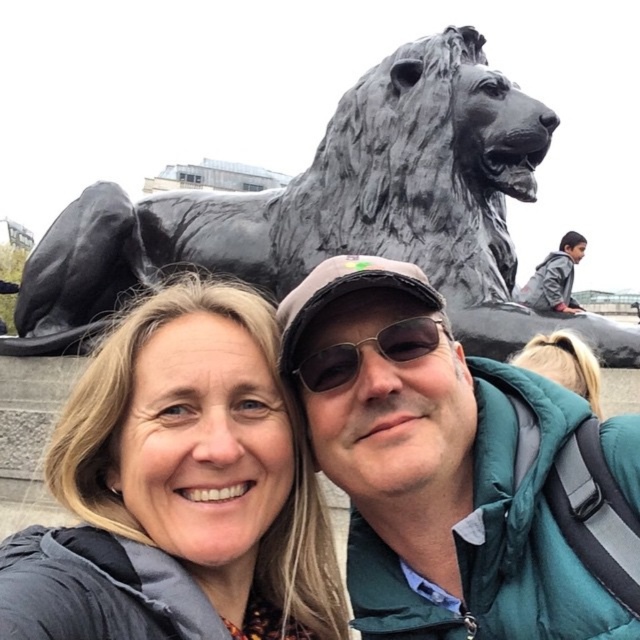
You are trying to locate the green puffy jacket at center in the image. According to the coordinates provided, where exactly is it positioned?

The green puffy jacket at center is located at point coordinates of 0.569 in the x axis and 0.881 in the y axis.

You are trying to determine if the black polished stone lion at upper center can fit through a doorway that is the same width as the green puffy jacket at center. Based on the scene, can it fit?

The black polished stone lion at upper center is wider than the green puffy jacket at center, so it cannot fit through the doorway that is the same width as the green puffy jacket at center.

You are taking a selfie with two friends in front of a large black lion statue. You notice the matte gray hair at center and the green puffy jacket at center. Which object is positioned lower in the image?

The matte gray hair at center is located below green puffy jacket at center, so the matte gray hair at center is positioned lower in the image.